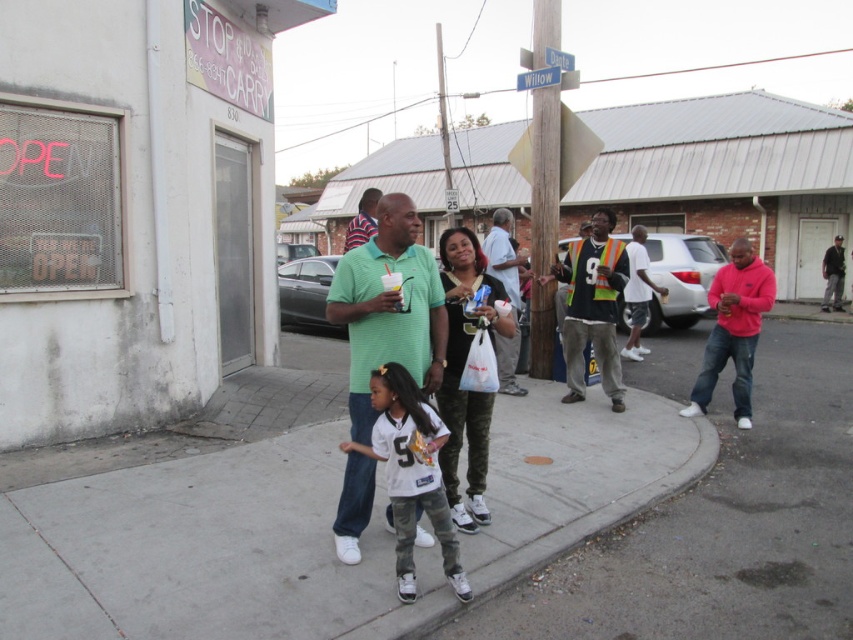
Does reflective safety vest at center appear over pink fleece at right?

Indeed, reflective safety vest at center is positioned over pink fleece at right.

Which is in front, point (579, 317) or point (740, 294)?

Point (740, 294)

Who is more distant from viewer, (618, 385) or (744, 353)?

Point (618, 385)

In order to click on reflective safety vest at center in this screenshot , I will do `click(592, 307)`.

The height and width of the screenshot is (640, 853). Find the location of `gray concrete sidewalk at center`. gray concrete sidewalk at center is located at coordinates (184, 541).

Between point (811, 413) and point (352, 234), which one is positioned in front?

Point (352, 234)

Measure the distance between point (611, 472) and camera.

Point (611, 472) is 5.29 meters away from camera.

Where is `gray concrete sidewalk at center`? The width and height of the screenshot is (853, 640). gray concrete sidewalk at center is located at coordinates (184, 541).

Does reflective safety vest at center have a greater height compared to brown wooden pole at center?

No, reflective safety vest at center is not taller than brown wooden pole at center.

Does point (605, 250) lie behind point (537, 289)?

No, (605, 250) is in front of (537, 289).

At what (x,y) coordinates should I click in order to perform the action: click on reflective safety vest at center. Please return your answer as a coordinate pair (x, y). This screenshot has height=640, width=853. Looking at the image, I should click on (592, 307).